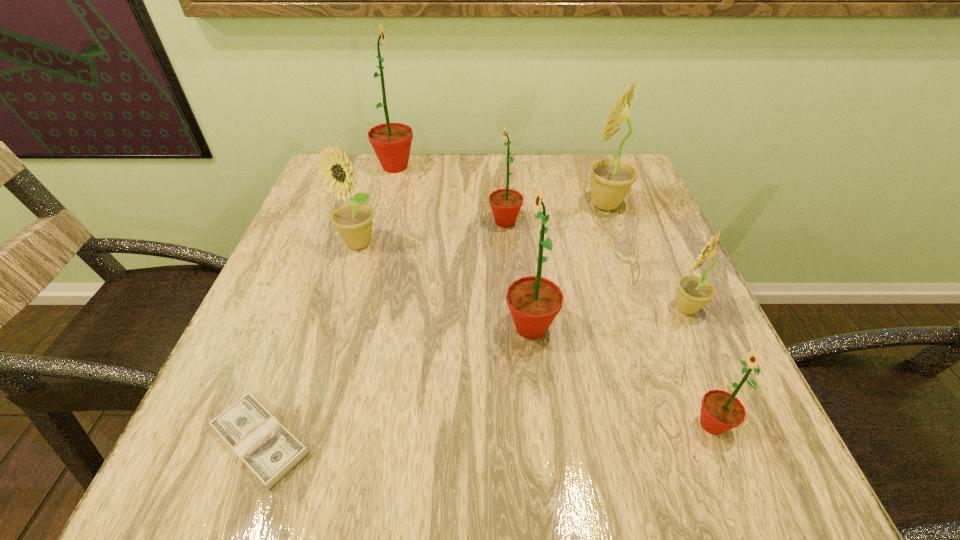
At what (x,y) coordinates should I click in order to perform the action: click on free space located on the face of the third nearest green sunflower. Please return your answer as a coordinate pair (x, y). Looking at the image, I should click on (326, 222).

The height and width of the screenshot is (540, 960). I want to click on vacant area located 0.260m on the face of the second nearest yellow sunflower, so click(x=324, y=357).

The height and width of the screenshot is (540, 960). Find the location of `vacant position located 0.400m on the face of the smallest yellow sunflower`. vacant position located 0.400m on the face of the smallest yellow sunflower is located at coordinates (458, 308).

The height and width of the screenshot is (540, 960). In order to click on vacant space located on the face of the smallest yellow sunflower in this screenshot , I will do `click(558, 308)`.

Locate an element on the screen. The image size is (960, 540). vacant space located on the face of the smallest yellow sunflower is located at coordinates (563, 308).

What are the coordinates of `vacant space located on the face of the smallest green sunflower` in the screenshot? It's located at (541, 424).

The image size is (960, 540). I want to click on free location located on the face of the smallest green sunflower, so click(501, 424).

Locate an element on the screen. This screenshot has height=540, width=960. free location located 0.310m on the face of the smallest green sunflower is located at coordinates (489, 424).

At what (x,y) coordinates should I click in order to perform the action: click on vacant region located 0.320m on the right of the dollar. Please return your answer as a coordinate pair (x, y). The image size is (960, 540). Looking at the image, I should click on (531, 441).

Identify the location of sunflower present at the near edge. (721, 411).